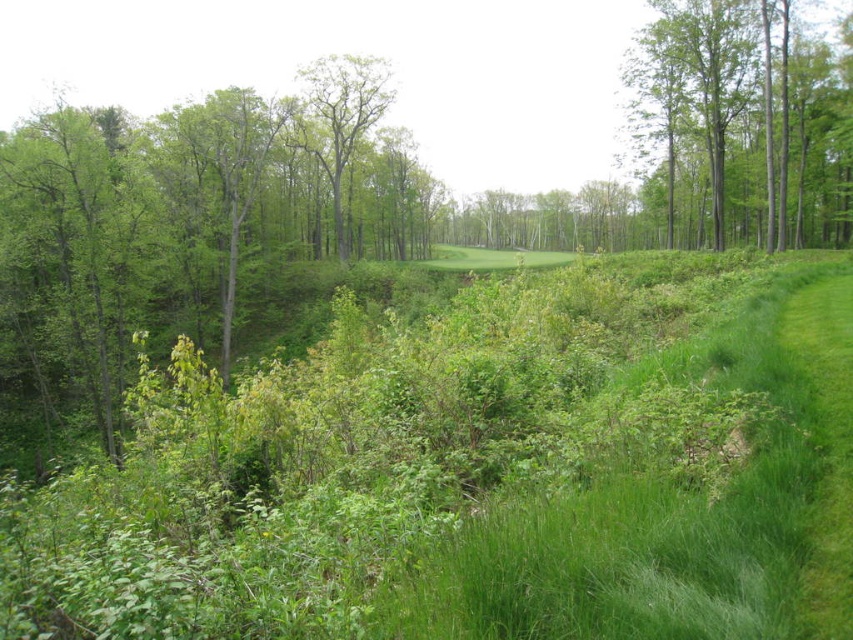
Question: Where is green smooth tree at upper right located in relation to green leafy tree at center in the image?

Choices:
 (A) above
 (B) below

Answer: (B)

Question: Does green grass at center have a lesser width compared to green smooth tree at upper right?

Choices:
 (A) yes
 (B) no

Answer: (B)

Question: Which point appears farthest from the camera in this image?

Choices:
 (A) (625, 586)
 (B) (323, 125)
 (C) (804, 156)

Answer: (B)

Question: Is green grass at center thinner than green leafy tree at center?

Choices:
 (A) yes
 (B) no

Answer: (B)

Question: Which point is farther from the camera taking this photo?

Choices:
 (A) (660, 51)
 (B) (781, 378)

Answer: (A)

Question: Which object is closer to the camera taking this photo?

Choices:
 (A) green smooth tree at upper right
 (B) green leafy tree at center
 (C) green grass at center

Answer: (C)